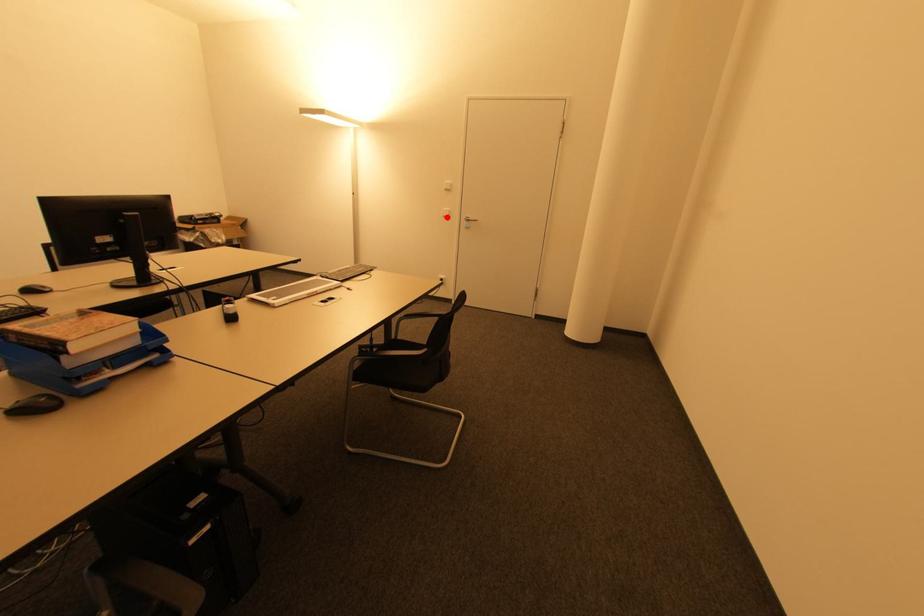
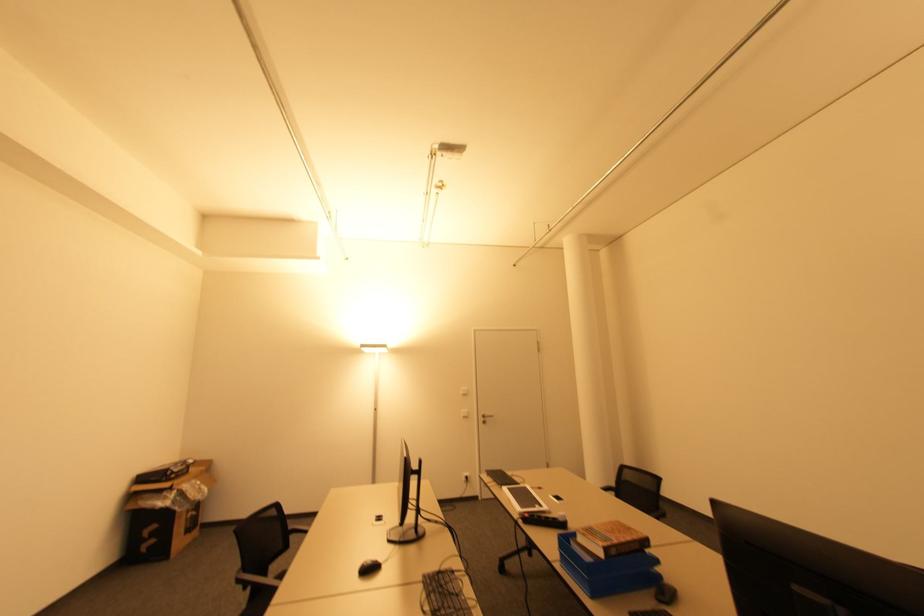
Where in the second image is the point corresponding to the highlighted location from the first image?

(467, 416)